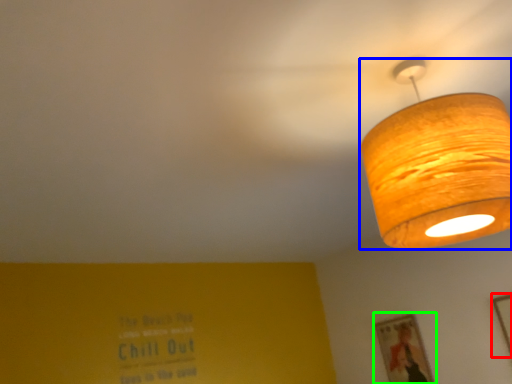
Question: Which object is the closest to the picture frame (highlighted by a red box)? Choose among these: lamp (highlighted by a blue box) or picture frame (highlighted by a green box).

Choices:
 (A) lamp
 (B) picture frame

Answer: (B)